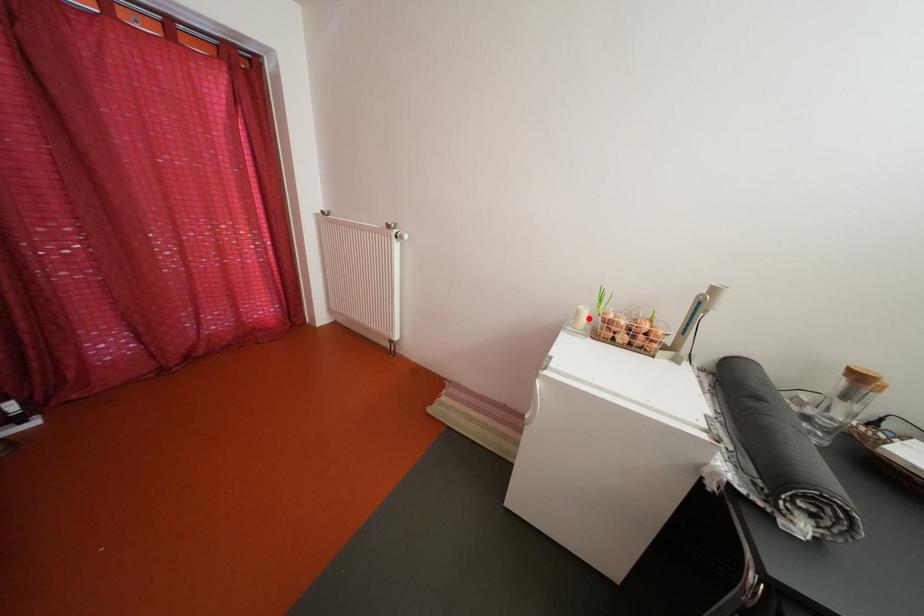
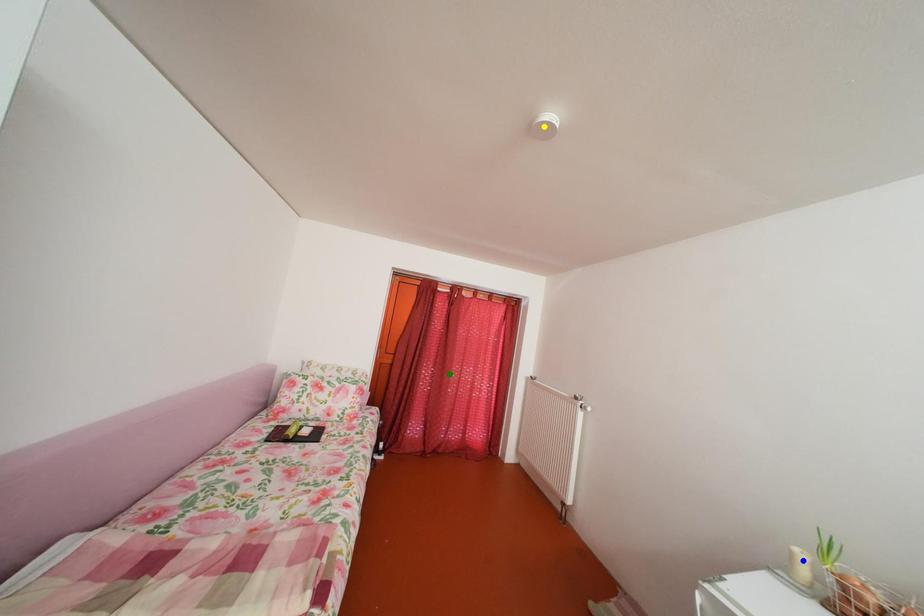
Question: I am providing you with two images of the same scene from different viewpoints. A red point is marked on the first image. You are given multiple points on the second image. Which point in image 2 is actually the same real-world point as the red point in image 1?

Choices:
 (A) yellow point
 (B) green point
 (C) blue point

Answer: (C)